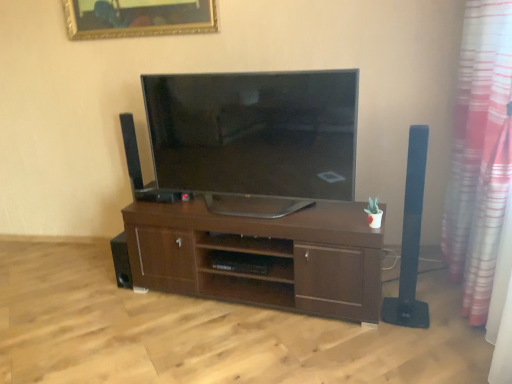
Question: Are gold-framed mirror at upper center and pink striped curtain at right far apart?

Choices:
 (A) yes
 (B) no

Answer: (A)

Question: Is gold-framed mirror at upper center bigger than pink striped curtain at right?

Choices:
 (A) yes
 (B) no

Answer: (B)

Question: Is gold-framed mirror at upper center closer to the viewer compared to pink striped curtain at right?

Choices:
 (A) yes
 (B) no

Answer: (B)

Question: Is gold-framed mirror at upper center further to the viewer compared to pink striped curtain at right?

Choices:
 (A) no
 (B) yes

Answer: (B)

Question: Can you confirm if gold-framed mirror at upper center is shorter than pink striped curtain at right?

Choices:
 (A) no
 (B) yes

Answer: (B)

Question: From a real-world perspective, is brown wood shelf at center physically located above or below black matte speaker at lower left, which appears as the 1th speaker when viewed from the left?

Choices:
 (A) above
 (B) below

Answer: (A)

Question: Looking at their shapes, would you say brown wood shelf at center is wider or thinner than black matte speaker at lower left, which appears as the 1th speaker when viewed from the left?

Choices:
 (A) thin
 (B) wide

Answer: (B)

Question: Is brown wood shelf at center in front of or behind black matte speaker at lower left, which appears as the 1th speaker when viewed from the left, in the image?

Choices:
 (A) front
 (B) behind

Answer: (A)

Question: From the image's perspective, is brown wood shelf at center located above or below black matte speaker at lower left, which appears as the second speaker when viewed from the front?

Choices:
 (A) below
 (B) above

Answer: (B)

Question: Is satin black tv at center bigger or smaller than brown wood cabinet at center?

Choices:
 (A) small
 (B) big

Answer: (A)

Question: Is satin black tv at center taller or shorter than brown wood cabinet at center?

Choices:
 (A) short
 (B) tall

Answer: (B)

Question: Is point 264,185 positioned closer to the camera than point 132,279?

Choices:
 (A) closer
 (B) farther

Answer: (A)

Question: Which is correct: satin black tv at center is inside brown wood cabinet at center, or outside of it?

Choices:
 (A) outside
 (B) inside

Answer: (A)

Question: Is satin black tv at center in front of or behind black matte speaker at right, marked as the 1th speaker in a right-to-left arrangement, in the image?

Choices:
 (A) front
 (B) behind

Answer: (B)

Question: From the image's perspective, is satin black tv at center above or below black matte speaker at right, which is the first speaker in front-to-back order?

Choices:
 (A) above
 (B) below

Answer: (A)